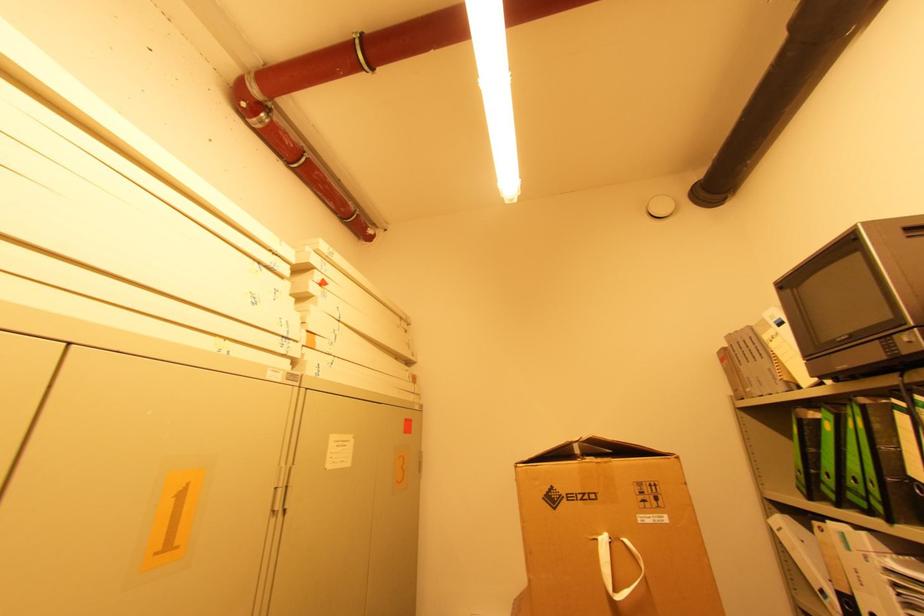
In order to click on white box handle in this screenshot , I will do `click(616, 565)`.